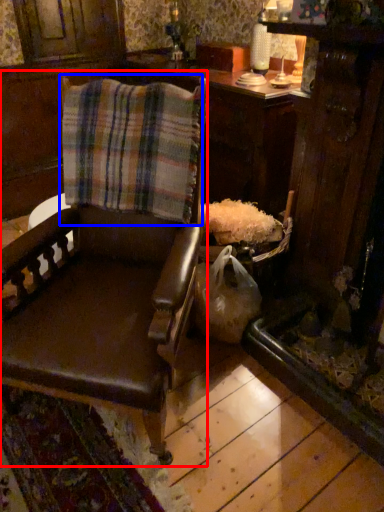
Question: Among these objects, which one is nearest to the camera, chair (highlighted by a red box) or flannel (highlighted by a blue box)?

Choices:
 (A) chair
 (B) flannel

Answer: (A)